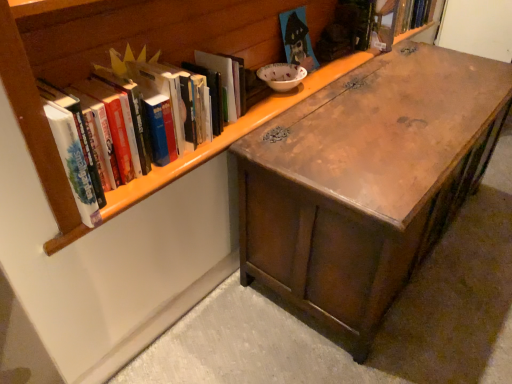
What is the approximate width of white matte book at upper left, the first book when ordered from left to right?

white matte book at upper left, the first book when ordered from left to right, is 7.71 inches in width.

Where is `white matte book at upper left, the third book when ordered from back to front`? This screenshot has height=384, width=512. white matte book at upper left, the third book when ordered from back to front is located at coordinates (156, 107).

What are the coordinates of `wooden chest at center` in the screenshot? It's located at (366, 181).

What is the approximate height of wooden chest at center?

wooden chest at center is 56.79 centimeters in height.

The image size is (512, 384). I want to click on wooden house-shaped book at upper center, the 2th book positioned from the right, so click(297, 39).

Is hardcover book at upper right, the 3th book from the bottom, aimed at wooden bookshelf at upper left?

Yes, hardcover book at upper right, the 3th book from the bottom, faces towards wooden bookshelf at upper left.

Considering the relative sizes of hardcover book at upper right, which ranks as the 1th book in top-to-bottom order, and wooden bookshelf at upper left in the image provided, is hardcover book at upper right, which ranks as the 1th book in top-to-bottom order, shorter than wooden bookshelf at upper left?

Correct, hardcover book at upper right, which ranks as the 1th book in top-to-bottom order, is not as tall as wooden bookshelf at upper left.

Can you confirm if hardcover book at upper right, positioned as the 3th book in front-to-back order, is thinner than wooden bookshelf at upper left?

Yes.

Which object is wider, wooden bookshelf at upper left or wooden chest at center?

wooden chest at center.

Would you say wooden bookshelf at upper left is outside wooden chest at center?

Yes.

Is wooden bookshelf at upper left touching wooden chest at center?

No, wooden bookshelf at upper left is not with wooden chest at center.

Between wooden chest at center and white matte book at upper left, the first book when ordered from left to right, which one is positioned behind?

wooden chest at center is more distant.

From the image's perspective, between wooden chest at center and white matte book at upper left, the 1th book from the bottom, which one is located above?

From the image's view, white matte book at upper left, the 1th book from the bottom, is above.

Who is shorter, wooden chest at center or white matte book at upper left, which appears as the 3th book when viewed from the right?

white matte book at upper left, which appears as the 3th book when viewed from the right.

Between hardcover book at upper right, the 3th book from the bottom, and white matte book at upper left, marked as the third book in a top-to-bottom arrangement, which one has less height?

hardcover book at upper right, the 3th book from the bottom.

From a real-world perspective, which book is the 2nd one above the hardcover book at upper right, the first book from the back? Please provide its 2D coordinates.

[(156, 107)]

Which is correct: hardcover book at upper right, positioned as the 3th book in front-to-back order, is inside white matte book at upper left, the first book when ordered from left to right, or outside of it?

hardcover book at upper right, positioned as the 3th book in front-to-back order, is not inside white matte book at upper left, the first book when ordered from left to right, it's outside.

Who is bigger, wooden house-shaped book at upper center, which is the second book from back to front, or wooden bookshelf at upper left?

Bigger between the two is wooden bookshelf at upper left.

Could you tell me if wooden house-shaped book at upper center, which is the second book from back to front, is turned towards wooden bookshelf at upper left?

Yes, wooden house-shaped book at upper center, which is the second book from back to front, faces towards wooden bookshelf at upper left.

Which of these two, wooden house-shaped book at upper center, positioned as the 2th book in bottom-to-top order, or wooden bookshelf at upper left, stands taller?

Standing taller between the two is wooden bookshelf at upper left.

From the image's perspective, is wooden house-shaped book at upper center, positioned as the 2th book in bottom-to-top order, on top of wooden bookshelf at upper left?

No.

From the image's perspective, is hardcover book at upper right, positioned as the 3th book in front-to-back order, located above or below wooden house-shaped book at upper center, which is the second book from back to front?

Clearly, from the image's perspective, hardcover book at upper right, positioned as the 3th book in front-to-back order, is above wooden house-shaped book at upper center, which is the second book from back to front.

Where is `book that is the 1st one when counting downward from the hardcover book at upper right, the first book from the back (from the image's perspective)`? This screenshot has width=512, height=384. book that is the 1st one when counting downward from the hardcover book at upper right, the first book from the back (from the image's perspective) is located at coordinates (297, 39).

From the picture: Which of these two, hardcover book at upper right, the 1th book viewed from the right, or wooden house-shaped book at upper center, acting as the second book starting from the front, is bigger?

With larger size is hardcover book at upper right, the 1th book viewed from the right.

Is hardcover book at upper right, the first book from the back, beside wooden house-shaped book at upper center, the 2th book positioned from the right?

No, hardcover book at upper right, the first book from the back, is not in contact with wooden house-shaped book at upper center, the 2th book positioned from the right.

Which object is thinner, wooden bookshelf at upper left or white matte book at upper left, the 1th book from the bottom?

white matte book at upper left, the 1th book from the bottom, is thinner.

Where is `book on the left of the wooden bookshelf at upper left`? Image resolution: width=512 pixels, height=384 pixels. book on the left of the wooden bookshelf at upper left is located at coordinates (156, 107).

Which of these two, wooden bookshelf at upper left or white matte book at upper left, which appears as the 3th book when viewed from the right, stands taller?

wooden bookshelf at upper left.

Is point (7, 4) positioned behind point (183, 106)?

No, (7, 4) is closer to viewer.

From a real-world perspective, starting from the wooden bookshelf at upper left, which book is the 3rd one below it? Please provide its 2D coordinates.

[(413, 14)]

The image size is (512, 384). In order to click on bookcase on the left of wooden chest at center in this screenshot , I will do `click(101, 58)`.

When comparing their distances from wooden house-shaped book at upper center, which is the second book from back to front, does wooden bookshelf at upper left or wooden chest at center seem closer?

wooden bookshelf at upper left is closer to wooden house-shaped book at upper center, which is the second book from back to front.

Based on their spatial positions, is hardcover book at upper right, the 1th book viewed from the right, or wooden chest at center further from wooden house-shaped book at upper center, the 2th book positioned from the right?

hardcover book at upper right, the 1th book viewed from the right, is further to wooden house-shaped book at upper center, the 2th book positioned from the right.

Which object lies further to the anchor point hardcover book at upper right, positioned as the 3th book in front-to-back order, wooden bookshelf at upper left or white matte book at upper left, the 1th book from the bottom?

white matte book at upper left, the 1th book from the bottom, is further to hardcover book at upper right, positioned as the 3th book in front-to-back order.

Looking at the image, which one is located closer to hardcover book at upper right, the 3th book from the left, white matte book at upper left, the 1th book from the bottom, or wooden house-shaped book at upper center, the second book viewed from the left?

wooden house-shaped book at upper center, the second book viewed from the left, lies closer to hardcover book at upper right, the 3th book from the left, than the other object.

Based on their spatial positions, is white matte book at upper left, which is the first book from front to back, or hardcover book at upper right, the first book from the back, further from wooden bookshelf at upper left?

Based on the image, hardcover book at upper right, the first book from the back, appears to be further to wooden bookshelf at upper left.

Based on their spatial positions, is wooden house-shaped book at upper center, the 2th book positioned from the right, or wooden chest at center closer to hardcover book at upper right, the 3th book from the left?

wooden house-shaped book at upper center, the 2th book positioned from the right, is closer to hardcover book at upper right, the 3th book from the left.

Estimate the real-world distances between objects in this image. Which object is closer to wooden house-shaped book at upper center, the 2th book positioned from the right, hardcover book at upper right, the 1th book viewed from the right, or white matte book at upper left, which is the first book from front to back?

hardcover book at upper right, the 1th book viewed from the right.

When comparing their distances from wooden house-shaped book at upper center, which is counted as the 2th book, starting from the top, does white matte book at upper left, which appears as the 3th book when viewed from the right, or hardcover book at upper right, the 3th book from the left, seem further?

white matte book at upper left, which appears as the 3th book when viewed from the right, lies further to wooden house-shaped book at upper center, which is counted as the 2th book, starting from the top, than the other object.

Image resolution: width=512 pixels, height=384 pixels. What are the coordinates of `book between wooden bookshelf at upper left and wooden house-shaped book at upper center, which is counted as the 2th book, starting from the top, in the front-back direction` in the screenshot? It's located at (156, 107).

The height and width of the screenshot is (384, 512). I want to click on book between white matte book at upper left, which is the first book from front to back, and wooden chest at center from left to right, so click(297, 39).

This screenshot has width=512, height=384. In order to click on book between wooden chest at center and hardcover book at upper right, positioned as the 3th book in front-to-back order, from front to back in this screenshot , I will do `click(297, 39)`.

Locate an element on the screen. This screenshot has width=512, height=384. desk located between white matte book at upper left, the third book when ordered from back to front, and hardcover book at upper right, the 3th book from the bottom, in the depth direction is located at coordinates (366, 181).